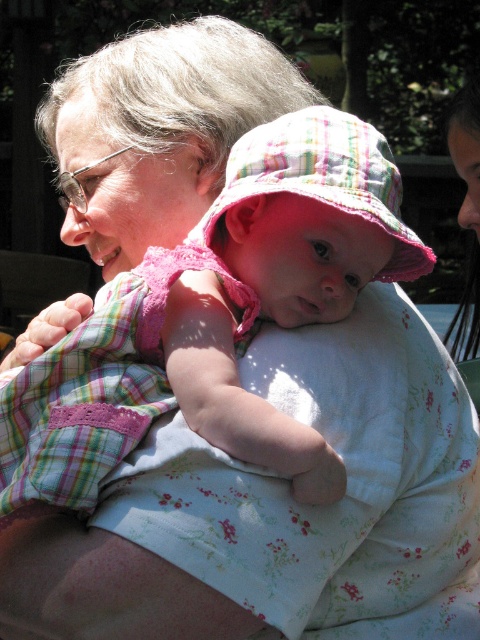
Does pink plaid dress at center have a lesser width compared to pink plaid hat at center?

Incorrect, pink plaid dress at center's width is not less than pink plaid hat at center's.

Is pink plaid dress at center to the right of pink plaid hat at center from the viewer's perspective?

In fact, pink plaid dress at center is to the left of pink plaid hat at center.

This screenshot has height=640, width=480. What do you see at coordinates (216, 317) in the screenshot?
I see `pink plaid dress at center` at bounding box center [216, 317].

The width and height of the screenshot is (480, 640). Identify the location of pink plaid dress at center. (216, 317).